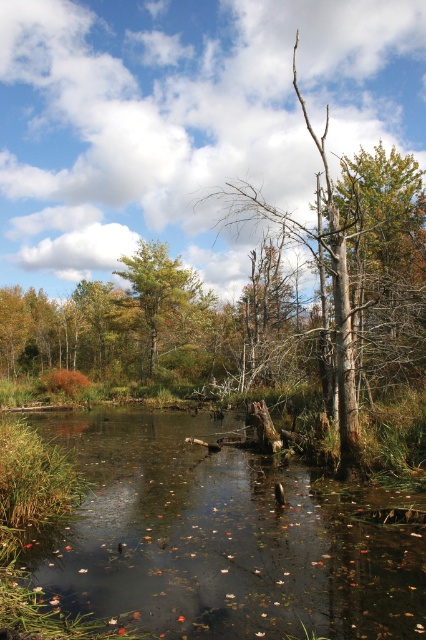
You are standing at the edge of the pond and want to take a photo of the green matte tree at center without the brown murky water at center appearing in the foreground. Is this possible?

The brown murky water at center is in front of the green matte tree at center, so it will block the view. You cannot take a photo of the green matte tree at center without the brown murky water at center appearing in the foreground.